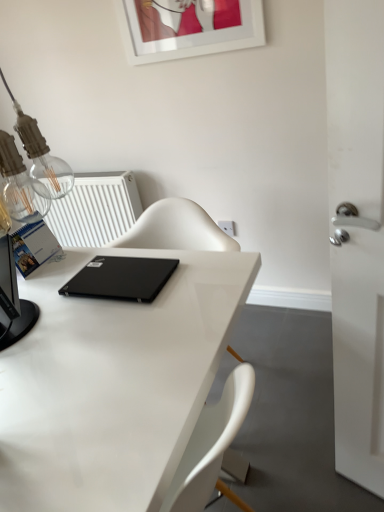
Describe the element at coordinates (188, 27) in the screenshot. I see `white glossy picture frame at upper center` at that location.

Where is `white plastic radiator at upper left`? This screenshot has height=512, width=384. white plastic radiator at upper left is located at coordinates (95, 209).

Measure the distance between white glossy desk at center and camera.

white glossy desk at center and camera are 28.01 inches apart from each other.

The height and width of the screenshot is (512, 384). I want to click on black matte laptop at center, so click(121, 278).

Is point (97, 273) behind point (5, 401)?

That is True.

Is the depth of black matte laptop at center greater than that of white glossy desk at center?

Yes, the depth of black matte laptop at center is greater than that of white glossy desk at center.

From a real-world perspective, is black matte laptop at center beneath white glossy desk at center?

Actually, black matte laptop at center is physically above white glossy desk at center in the real world.

Is white plastic radiator at upper left at the right side of white plastic electric outlet at upper center?

No, white plastic radiator at upper left is not to the right of white plastic electric outlet at upper center.

Find the location of a particular element. The height and width of the screenshot is (512, 384). electric outlet directly beneath the white plastic radiator at upper left (from a real-world perspective) is located at coordinates (227, 227).

Does point (90, 204) appear closer or farther from the camera than point (226, 225)?

Point (90, 204) appears to be farther away from the viewer than point (226, 225).

From a real-world perspective, relative to white plastic electric outlet at upper center, is white plastic radiator at upper left vertically above or below?

From a real-world perspective, white plastic radiator at upper left is physically above white plastic electric outlet at upper center.

Considering the positions of point (231, 228) and point (124, 7), is point (231, 228) closer or farther from the camera than point (124, 7)?

Point (231, 228) is positioned closer to the camera compared to point (124, 7).

From the image's perspective, which one is positioned higher, white plastic electric outlet at upper center or white glossy picture frame at upper center?

white glossy picture frame at upper center is shown above in the image.

How far apart are white plastic electric outlet at upper center and white glossy picture frame at upper center?

white plastic electric outlet at upper center and white glossy picture frame at upper center are 33.15 inches apart from each other.

Considering the relative positions of white plastic electric outlet at upper center and white glossy picture frame at upper center in the image provided, is white plastic electric outlet at upper center to the right of white glossy picture frame at upper center from the viewer's perspective?

Yes.

Image resolution: width=384 pixels, height=512 pixels. I want to click on electric outlet on the right of white glossy desk at center, so click(x=227, y=227).

From their relative heights in the image, would you say white plastic electric outlet at upper center is taller or shorter than white glossy desk at center?

Clearly, white plastic electric outlet at upper center is shorter compared to white glossy desk at center.

Does white plastic electric outlet at upper center have a larger size compared to white glossy desk at center?

No, white plastic electric outlet at upper center is not bigger than white glossy desk at center.

Is white glossy desk at center bigger or smaller than white plastic electric outlet at upper center?

In the image, white glossy desk at center appears to be larger than white plastic electric outlet at upper center.

From a real-world perspective, which is physically above, white glossy desk at center or white plastic electric outlet at upper center?

In real-world perspective, white plastic electric outlet at upper center is above.

Looking at this image, is white glossy desk at center directly adjacent to white plastic electric outlet at upper center?

white glossy desk at center and white plastic electric outlet at upper center are clearly separated.

From the image's perspective, which is above, white glossy desk at center or white plastic electric outlet at upper center?

white plastic electric outlet at upper center appears higher in the image.

From a real-world perspective, is white plastic electric outlet at upper center beneath black matte laptop at center?

Indeed, from a real-world perspective, white plastic electric outlet at upper center is positioned beneath black matte laptop at center.

Between white plastic electric outlet at upper center and black matte laptop at center, which one has less height?

black matte laptop at center is shorter.

From the picture: From the image's perspective, is white plastic electric outlet at upper center above or below black matte laptop at center?

Based on their image positions, white plastic electric outlet at upper center is located above black matte laptop at center.

Measure the distance from white glossy picture frame at upper center to white plastic electric outlet at upper center.

A distance of 33.15 inches exists between white glossy picture frame at upper center and white plastic electric outlet at upper center.

Based on their sizes in the image, would you say white glossy picture frame at upper center is bigger or smaller than white plastic electric outlet at upper center?

In the image, white glossy picture frame at upper center appears to be larger than white plastic electric outlet at upper center.

From the image's perspective, is white glossy picture frame at upper center located above or below white plastic electric outlet at upper center?

white glossy picture frame at upper center is above white plastic electric outlet at upper center.

You are a GUI agent. You are given a task and a screenshot of the screen. Output one action in this format:
    pyautogui.click(x=<x>, y=<y>)
    Task: Click on the laptop that appears on the left of white glossy desk at center
    
    Given the screenshot: What is the action you would take?
    pyautogui.click(x=121, y=278)

At what (x,y) coordinates should I click in order to perform the action: click on electric outlet below the white plastic radiator at upper left (from a real-world perspective). Please return your answer as a coordinate pair (x, y). The width and height of the screenshot is (384, 512). Looking at the image, I should click on (227, 227).

Considering their positions, is white glossy desk at center positioned further to white plastic electric outlet at upper center than white plastic radiator at upper left?

The object further to white plastic electric outlet at upper center is white plastic radiator at upper left.

Considering their positions, is white plastic electric outlet at upper center positioned further to white glossy picture frame at upper center than white plastic radiator at upper left?

The object further to white glossy picture frame at upper center is white plastic electric outlet at upper center.

Which object lies nearer to the anchor point black matte laptop at center, white plastic electric outlet at upper center or white plastic radiator at upper left?

white plastic electric outlet at upper center.

From the image, which object appears to be nearer to white plastic electric outlet at upper center, white glossy desk at center or white glossy picture frame at upper center?

white glossy desk at center.

Looking at the image, which one is located closer to white glossy desk at center, white plastic radiator at upper left or black matte laptop at center?

black matte laptop at center.

Considering their positions, is white glossy picture frame at upper center positioned further to white plastic electric outlet at upper center than black matte laptop at center?

white glossy picture frame at upper center.

Based on their spatial positions, is white glossy picture frame at upper center or white plastic radiator at upper left closer to white plastic electric outlet at upper center?

white plastic radiator at upper left is positioned closer to the anchor white plastic electric outlet at upper center.

When comparing their distances from black matte laptop at center, does white glossy picture frame at upper center or white plastic radiator at upper left seem closer?

The object closer to black matte laptop at center is white plastic radiator at upper left.

In order to click on radiator between white glossy desk at center and white plastic electric outlet at upper center along the z-axis in this screenshot , I will do click(x=95, y=209).

Image resolution: width=384 pixels, height=512 pixels. I want to click on radiator between white glossy picture frame at upper center and white glossy desk at center from top to bottom, so click(x=95, y=209).

At what (x,y) coordinates should I click in order to perform the action: click on electric outlet that lies between white glossy picture frame at upper center and white glossy desk at center from top to bottom. Please return your answer as a coordinate pair (x, y). Looking at the image, I should click on (227, 227).

At what (x,y) coordinates should I click in order to perform the action: click on electric outlet between white glossy picture frame at upper center and black matte laptop at center vertically. Please return your answer as a coordinate pair (x, y). This screenshot has height=512, width=384. Looking at the image, I should click on (227, 227).